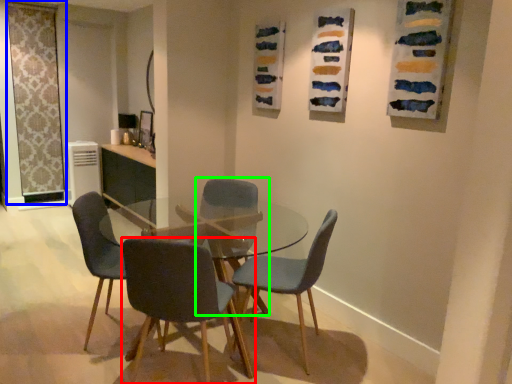
Question: Considering the real-world distances, which object is closest to chair (highlighted by a red box)? screen door (highlighted by a blue box) or chair (highlighted by a green box).

Choices:
 (A) screen door
 (B) chair

Answer: (B)